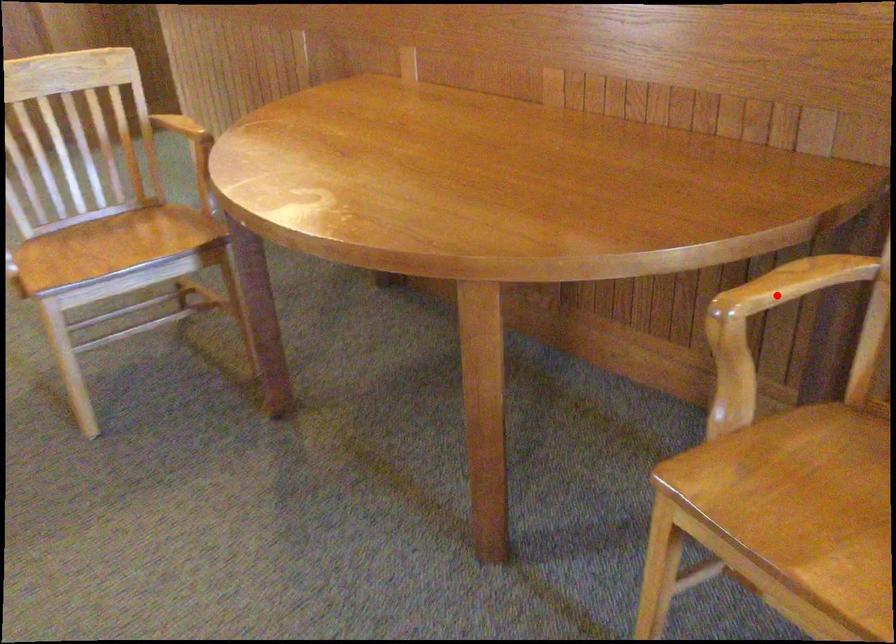
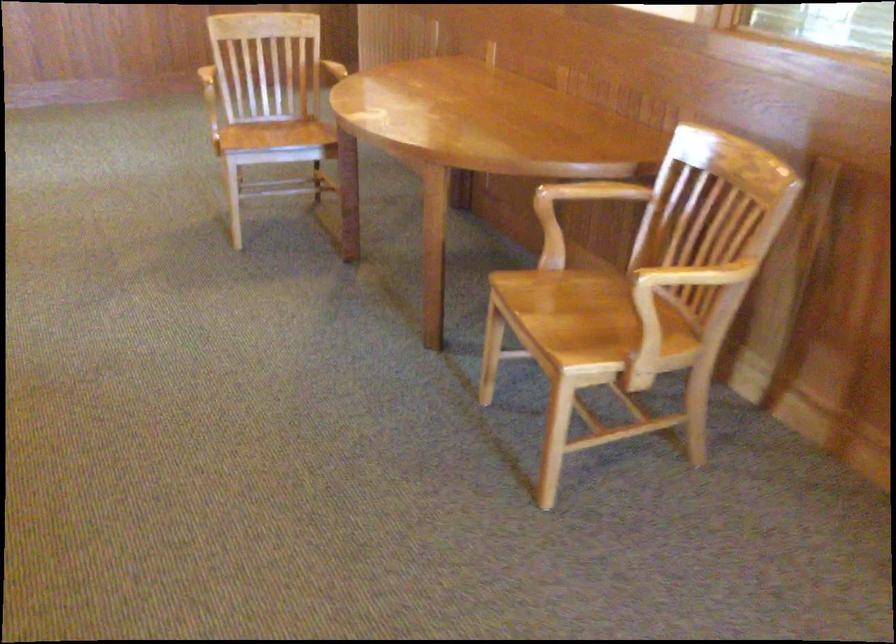
In the second image, find the point that corresponds to the highlighted location in the first image.

(587, 194)